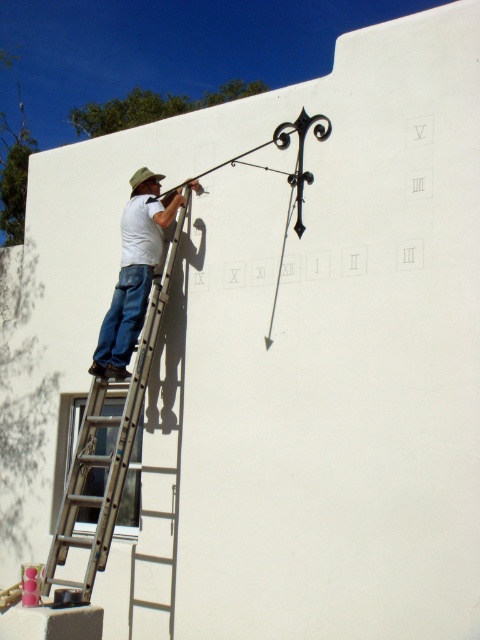
Is silver metallic ladder at left in front of white matte shirt at upper left?

Yes, it is.

Does silver metallic ladder at left appear over white matte shirt at upper left?

Actually, silver metallic ladder at left is below white matte shirt at upper left.

Identify the location of silver metallic ladder at left. The width and height of the screenshot is (480, 640). (107, 456).